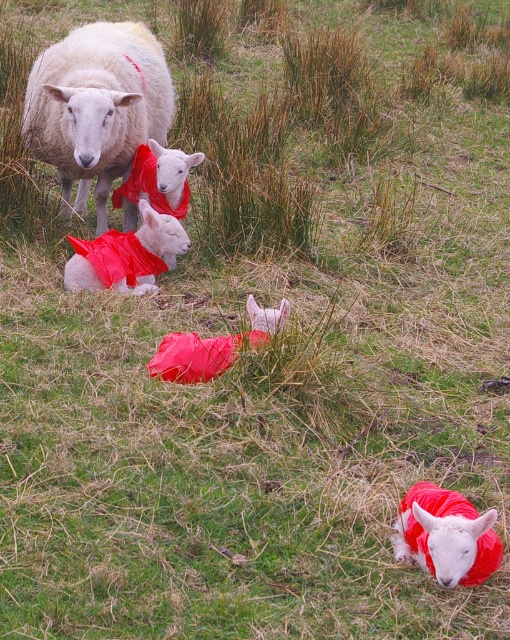
You are a farmer checking the field. You notice the white woolen sheep at upper left and the matte red coat at lower right. Which object is wider?

The white woolen sheep at upper left might be wider than matte red coat at lower right according to the description.

You are a photographer wanting to capture a photo of both the white woolen sheep at upper left and the matte red coat at lower right in the same frame. Based on their positions, which one should you adjust your camera focus on first to ensure both are in the frame?

The white woolen sheep at upper left is positioned on the left side of matte red coat at lower right, so you should focus on the matte red coat at lower right first to ensure both are in the frame.

You are a shepherd trying to locate the white woolen sheep at upper left in the field. Based on the coordinates provided, where exactly would you find it?

The white woolen sheep at upper left is located at coordinates point (96, 106).